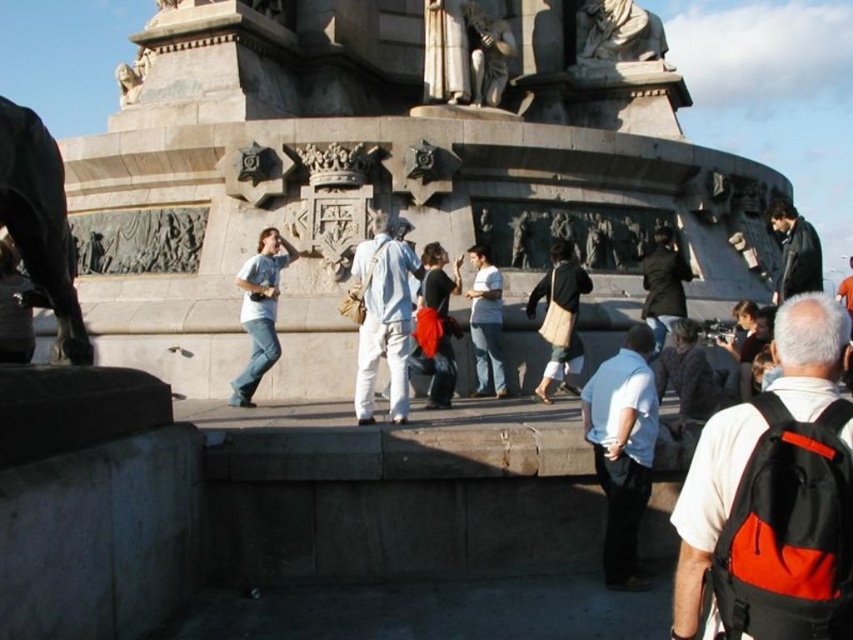
Between point (442, 280) and point (654, 337), which one is positioned behind?

Positioned behind is point (654, 337).

Based on the photo, between matte black jacket at center and dark brown leather jacket at center, which one appears on the right side from the viewer's perspective?

From the viewer's perspective, dark brown leather jacket at center appears more on the right side.

Which is behind, point (445, 324) or point (666, 300)?

Point (666, 300)

Find the location of `matte black jacket at center`. matte black jacket at center is located at coordinates (437, 323).

From the picture: Is white matte shirt at center to the left of black cotton bag at center from the viewer's perspective?

No, white matte shirt at center is not to the left of black cotton bag at center.

Can you confirm if white matte shirt at center is positioned above black cotton bag at center?

No.

Locate an element on the screen. white matte shirt at center is located at coordinates (622, 448).

Is black cotton bag at center wider than black leather jacket at upper right?

No, black cotton bag at center is not wider than black leather jacket at upper right.

Between point (532, 314) and point (799, 237), which one is positioned in front?

Point (532, 314) is in front.

Is point (556, 248) positioned after point (795, 269)?

No, (556, 248) is in front of (795, 269).

In order to click on black cotton bag at center in this screenshot , I will do `click(560, 317)`.